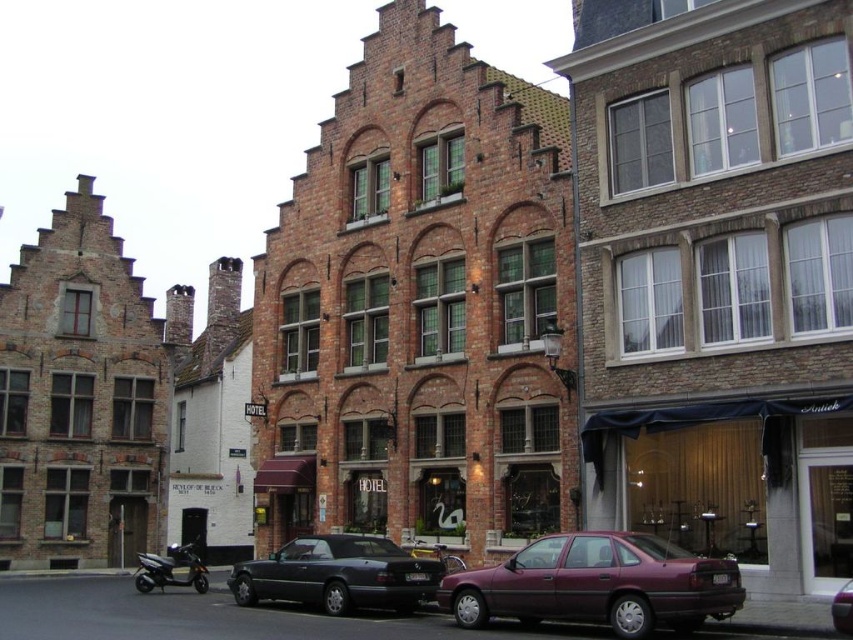
Who is more forward, (445, 556) or (840, 608)?

Point (840, 608) is more forward.

Between shiny metallic motorcycle at center and metallic maroon sedan at center, which one has more height?

metallic maroon sedan at center

Is point (428, 552) behind point (846, 588)?

Yes, point (428, 552) is farther from viewer.

The height and width of the screenshot is (640, 853). I want to click on shiny metallic motorcycle at center, so click(x=436, y=554).

Between shiny black convertible at center and shiny black scooter at lower left, which one has less height?

shiny black convertible at center is shorter.

Measure the distance from shiny black convertible at center to shiny black scooter at lower left.

shiny black convertible at center and shiny black scooter at lower left are 41.90 feet apart.

Is point (427, 582) positioned after point (196, 589)?

No, it is not.

The image size is (853, 640). I want to click on shiny black convertible at center, so click(338, 573).

Does maroon metallic car at lower right have a smaller size compared to shiny black convertible at center?

Indeed, maroon metallic car at lower right has a smaller size compared to shiny black convertible at center.

At what (x,y) coordinates should I click in order to perform the action: click on maroon metallic car at lower right. Please return your answer as a coordinate pair (x, y). This screenshot has height=640, width=853. Looking at the image, I should click on (596, 584).

Who is more distant from viewer, (682, 588) or (274, 588)?

Positioned behind is point (274, 588).

Locate an element on the screen. maroon metallic car at lower right is located at coordinates (596, 584).